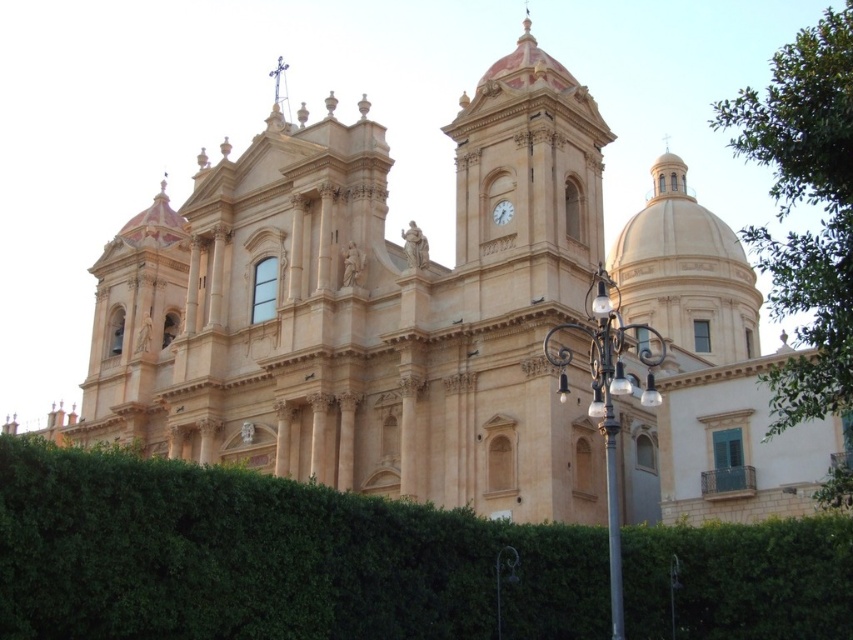
Can you confirm if green leafy bush at center is taller than metallic pole at center?

Incorrect, green leafy bush at center's height is not larger of metallic pole at center's.

Who is lower down, green leafy bush at center or metallic pole at center?

Positioned lower is green leafy bush at center.

What do you see at coordinates (267, 557) in the screenshot? This screenshot has width=853, height=640. I see `green leafy bush at center` at bounding box center [267, 557].

This screenshot has width=853, height=640. In order to click on green leafy bush at center in this screenshot , I will do [x=267, y=557].

From the picture: Is green leafy bush at center smaller than green leafy tree at upper right?

Yes.

From the picture: Does green leafy bush at center come behind green leafy tree at upper right?

That is True.

The image size is (853, 640). What do you see at coordinates (267, 557) in the screenshot? I see `green leafy bush at center` at bounding box center [267, 557].

Identify the location of green leafy bush at center. This screenshot has height=640, width=853. (267, 557).

Who is more distant from viewer, [846,355] or [610,557]?

Positioned behind is point [610,557].

Does green leafy tree at upper right have a lesser width compared to metallic pole at center?

No.

Image resolution: width=853 pixels, height=640 pixels. Find the location of `green leafy tree at upper right`. green leafy tree at upper right is located at coordinates (807, 204).